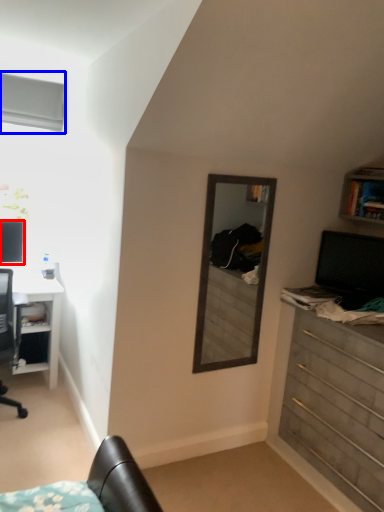
Question: Among these objects, which one is farthest to the camera, computer monitor (highlighted by a red box) or window (highlighted by a blue box)?

Choices:
 (A) computer monitor
 (B) window

Answer: (A)